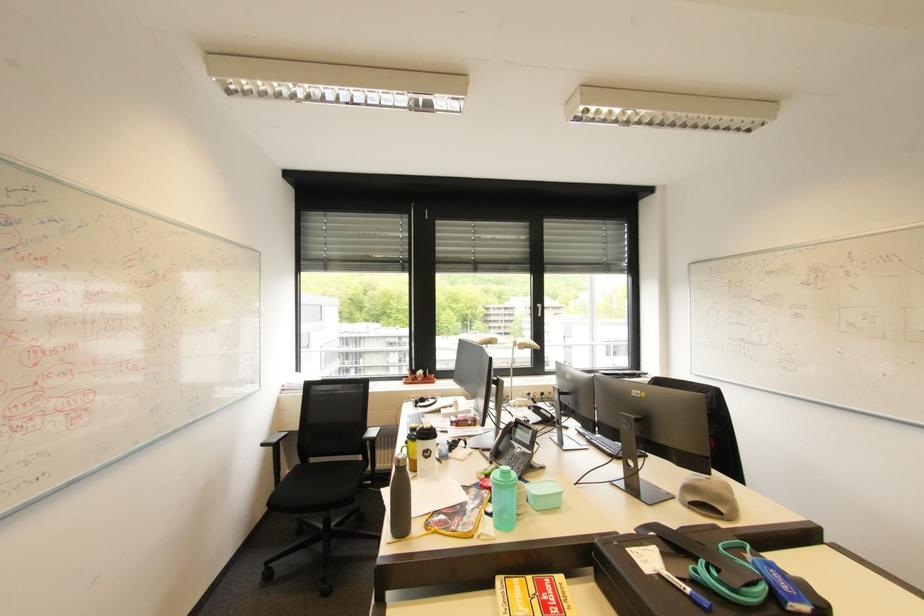
The image size is (924, 616). I want to click on grey metal bottle, so click(399, 498).